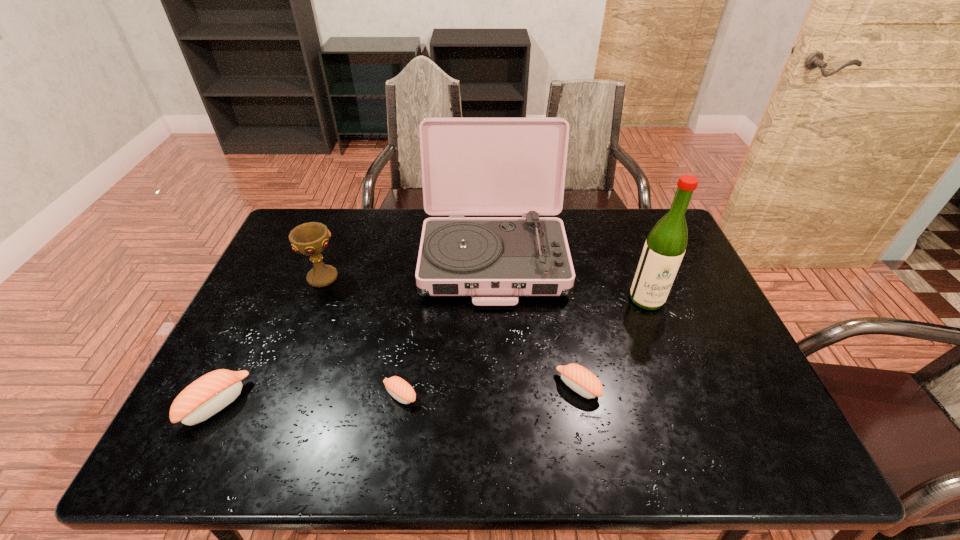
The width and height of the screenshot is (960, 540). What are the coordinates of `vacant region between the record player and the rightmost sushi` in the screenshot? It's located at (536, 322).

Where is `blank region between the leftmost object and the shortest sushi`? The height and width of the screenshot is (540, 960). blank region between the leftmost object and the shortest sushi is located at coordinates (308, 399).

Locate an element on the screen. This screenshot has height=540, width=960. free spot between the second tallest sushi and the rightmost object is located at coordinates (612, 343).

Find the location of a particular element. empty location between the second object from left to right and the tallest sushi is located at coordinates (269, 340).

The image size is (960, 540). I want to click on free space between the leftmost sushi and the record player, so click(355, 330).

Identify the location of blank region between the liquor and the shortest object. (523, 347).

Locate an element on the screen. The height and width of the screenshot is (540, 960). object that is the fifth closest one to the liquor is located at coordinates (206, 396).

Select which object appears as the third closest to the rightmost sushi. Please provide its 2D coordinates. Your answer should be formatted as a tuple, i.e. [(x, y)], where the tuple contains the x and y coordinates of a point satisfying the conditions above.

[(398, 388)]

I want to click on sushi that is the closest to the shortest sushi, so [206, 396].

Identify which sushi is the nearest to the tallest sushi. Please provide its 2D coordinates. Your answer should be formatted as a tuple, i.e. [(x, y)], where the tuple contains the x and y coordinates of a point satisfying the conditions above.

[(398, 388)]